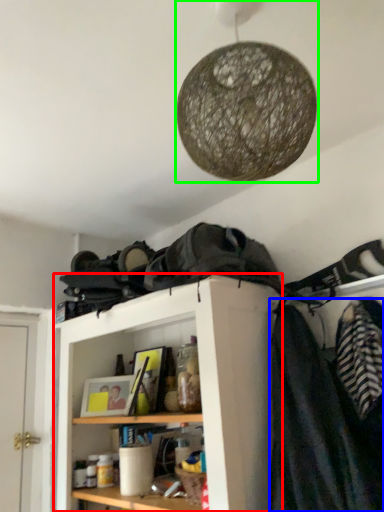
Question: Estimate the real-world distances between objects in this image. Which object is closer to shelf (highlighted by a red box), clothing (highlighted by a blue box) or lamp (highlighted by a green box)?

Choices:
 (A) clothing
 (B) lamp

Answer: (A)